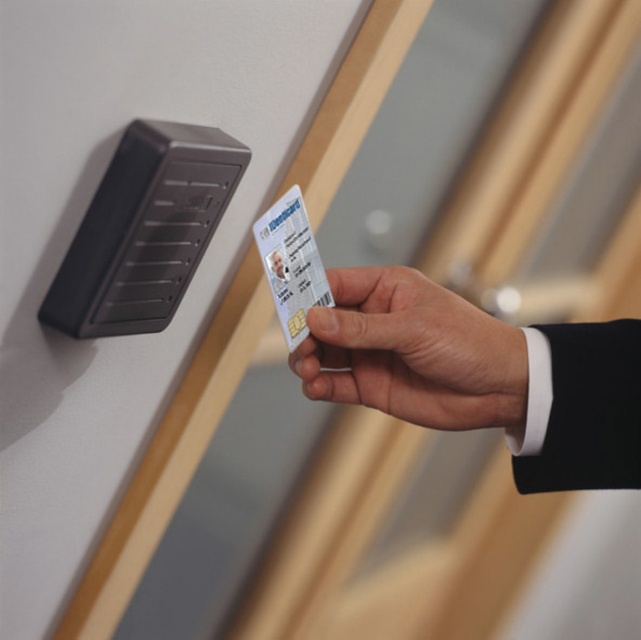
Question: Does white matte id card at upper right have a lesser width compared to black plastic lock at upper left?

Choices:
 (A) no
 (B) yes

Answer: (A)

Question: Does white matte id card at upper right lie behind white plastic card at center?

Choices:
 (A) no
 (B) yes

Answer: (B)

Question: Among these points, which one is farthest from the camera?

Choices:
 (A) (554, 369)
 (B) (160, 184)
 (C) (458, 364)
 (D) (272, 240)

Answer: (C)

Question: Which point is farther to the camera?

Choices:
 (A) white matte id card at upper right
 (B) white matte id card at center

Answer: (A)

Question: Which of the following is the closest to the observer?

Choices:
 (A) tap(192, 225)
 (B) tap(545, 336)
 (C) tap(272, 250)
 (D) tap(328, 400)

Answer: (A)

Question: Can you confirm if white matte id card at upper right is thinner than black plastic lock at upper left?

Choices:
 (A) yes
 (B) no

Answer: (B)